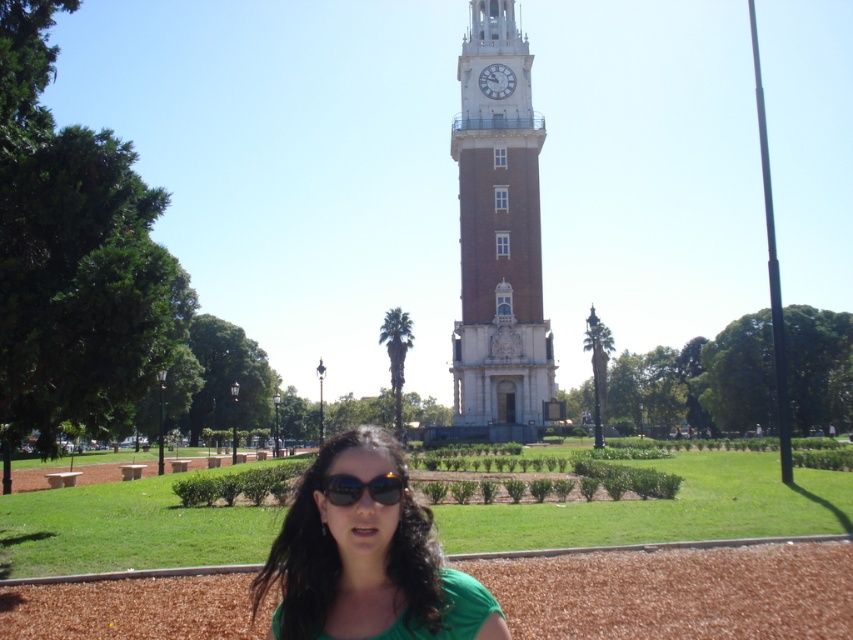
Does point (482, 292) lie in front of point (502, 84)?

Yes, it is in front of point (502, 84).

Which of these two, brown brick clock tower at center or white marble clock at upper center, stands shorter?

Standing shorter between the two is white marble clock at upper center.

The width and height of the screenshot is (853, 640). What do you see at coordinates (498, 234) in the screenshot? I see `brown brick clock tower at center` at bounding box center [498, 234].

Identify the location of brown brick clock tower at center. (498, 234).

Between green matte shirt at center and black reflective sunglasses at center, which one is positioned lower?

green matte shirt at center

Is point (270, 580) more distant than point (347, 490)?

Yes.

This screenshot has width=853, height=640. In order to click on green matte shirt at center in this screenshot , I will do click(x=366, y=554).

Identify the location of green matte shirt at center. Image resolution: width=853 pixels, height=640 pixels. (366, 554).

Does green matte shirt at center appear under white marble clock at upper center?

Yes.

Is green matte shirt at center thinner than white marble clock at upper center?

No.

Is point (358, 460) positioned before point (482, 77)?

Yes, point (358, 460) is closer to viewer.

Find the location of a particular element. green matte shirt at center is located at coordinates (366, 554).